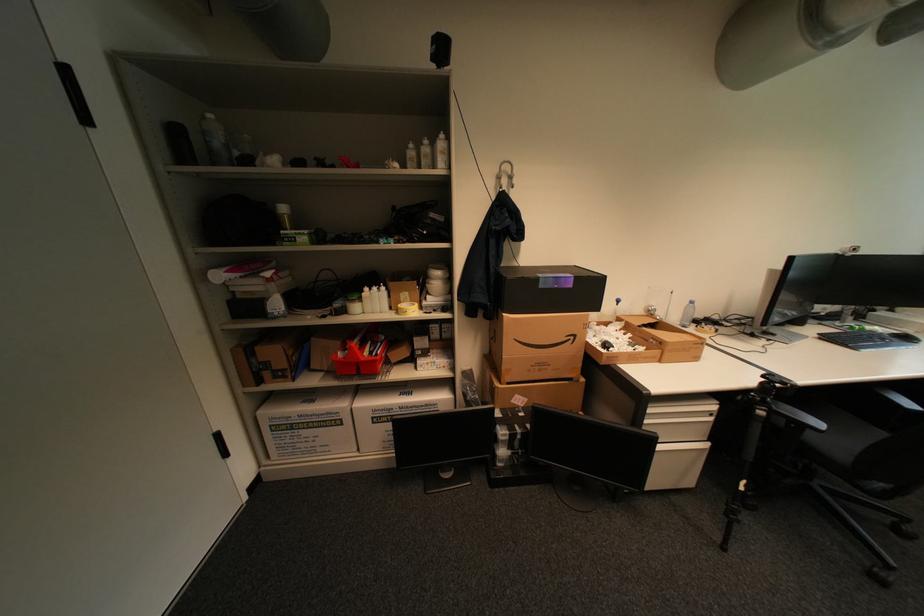
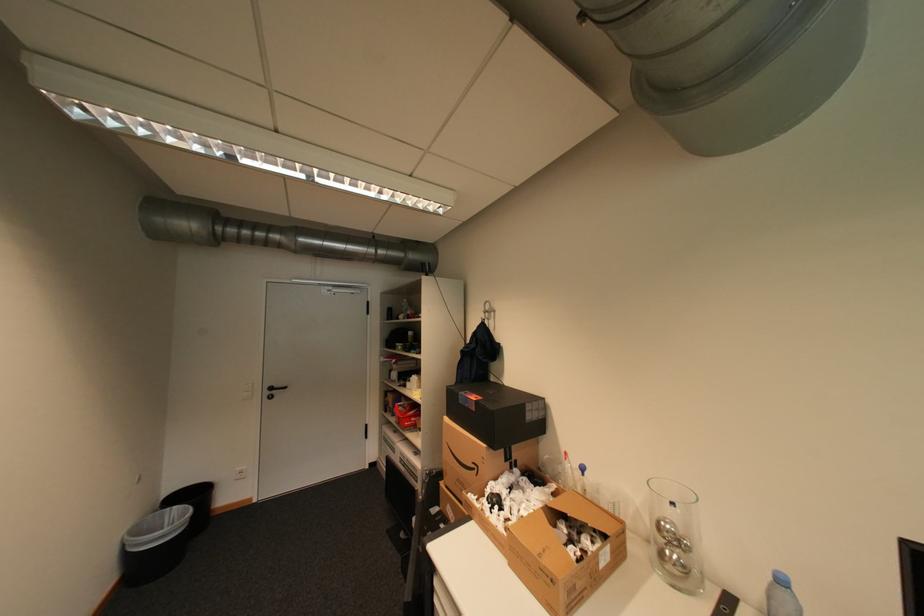
Where in the second image is the point corresponding to pixel 565 286 from the first image?

(476, 406)